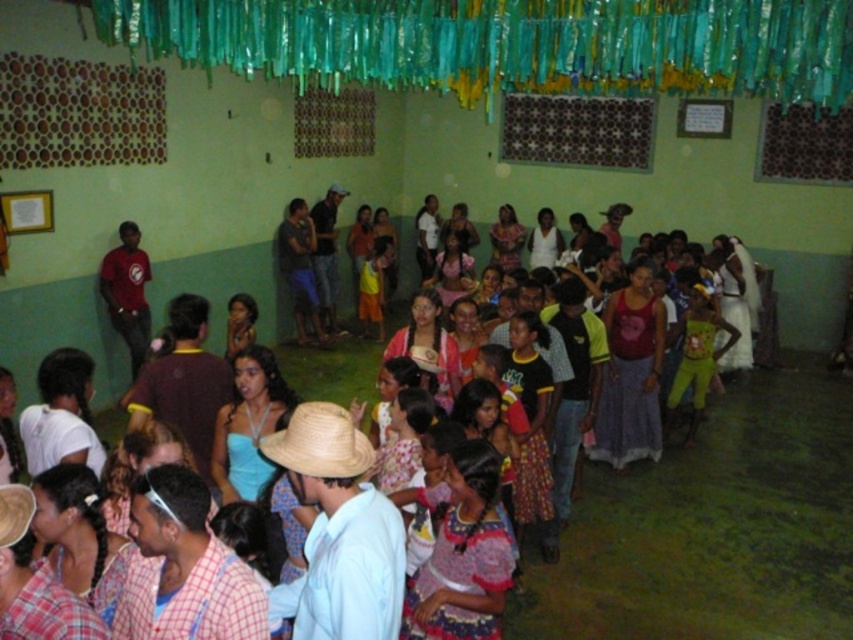
Does teal fabric curtain at upper center have a lesser width compared to straw hat at center?

No.

Is teal fabric curtain at upper center closer to camera compared to straw hat at center?

No, it is not.

Identify the location of teal fabric curtain at upper center. The height and width of the screenshot is (640, 853). (508, 44).

Can you confirm if diverse clothing at center is bigger than straw hat at center?

Yes.

Which is above, diverse clothing at center or straw hat at center?

straw hat at center

Is point (222, 250) closer to camera compared to point (370, 454)?

No.

Locate an element on the screen. This screenshot has width=853, height=640. diverse clothing at center is located at coordinates (662, 545).

Between diverse clothing at center and straw hat at lower left, which one appears on the left side from the viewer's perspective?

straw hat at lower left is more to the left.

Which is in front, point (572, 572) or point (4, 513)?

Positioned in front is point (4, 513).

The height and width of the screenshot is (640, 853). I want to click on diverse clothing at center, so click(662, 545).